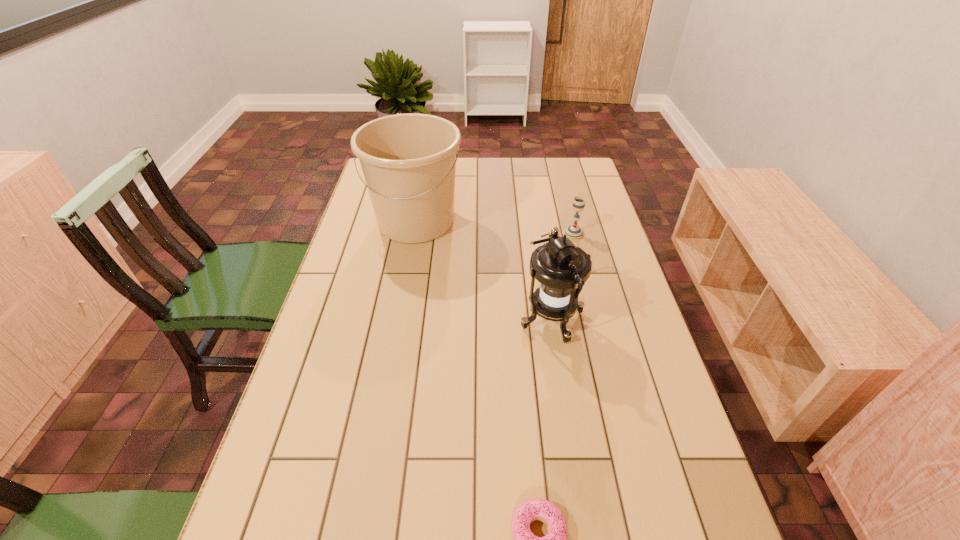
Locate an element on the screen. The image size is (960, 540). vacant space that satisfies the following two spatial constraints: 1. on the front side of the bucket; 2. on the right side of the lantern is located at coordinates (397, 320).

The width and height of the screenshot is (960, 540). What are the coordinates of `free space that satisfies the following two spatial constraints: 1. on the back side of the lantern; 2. on the right side of the chalice` in the screenshot? It's located at (539, 233).